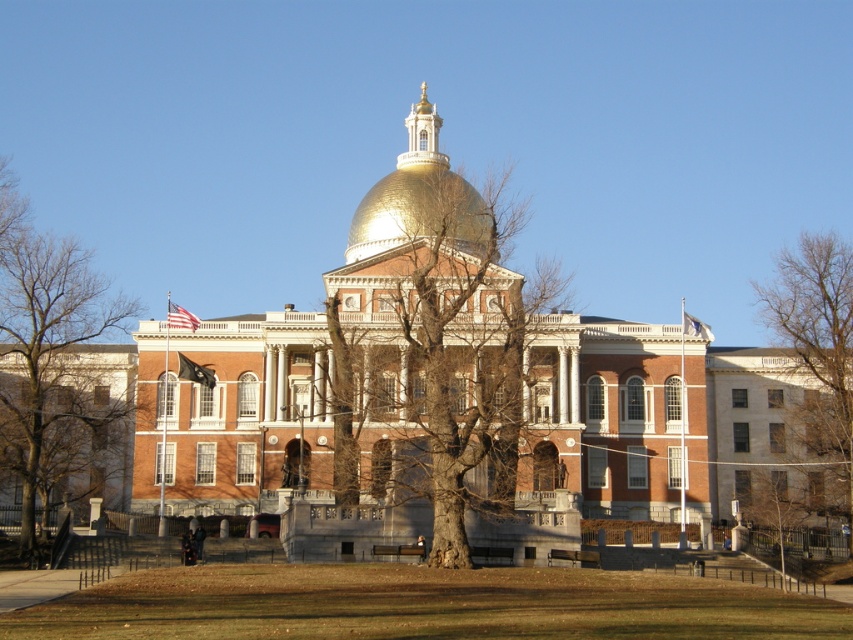
Question: Which point appears farthest from the camera in this image?

Choices:
 (A) (62, 390)
 (B) (468, 435)
 (C) (778, 305)

Answer: (C)

Question: Can you confirm if bare wood tree at right is positioned above gold polished dome at center?

Choices:
 (A) yes
 (B) no

Answer: (B)

Question: In this image, where is bare wood tree at left located relative to gold polished dome at center?

Choices:
 (A) right
 (B) left

Answer: (B)

Question: Where is bare wood tree at left located in relation to bare wood tree at right in the image?

Choices:
 (A) above
 (B) below

Answer: (B)

Question: Which is farther from the gold polished dome at center?

Choices:
 (A) bare wood tree at right
 (B) bare wood tree at center

Answer: (A)

Question: Which point is farther to the camera?

Choices:
 (A) (834, 442)
 (B) (15, 442)

Answer: (A)